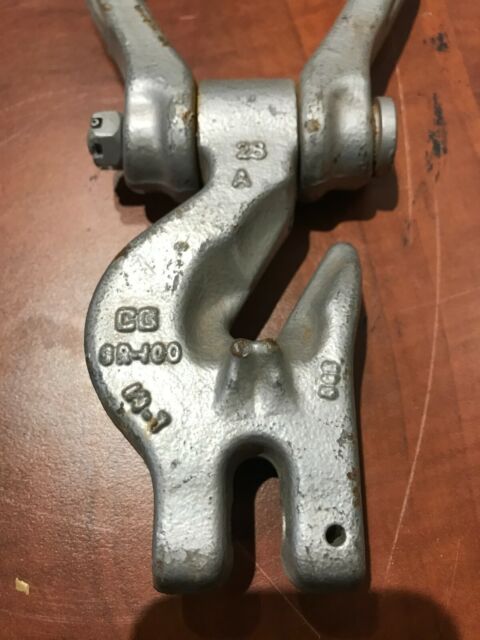
Identify the location of two bar attachments. This screenshot has height=640, width=480. (334, 54), (147, 48).